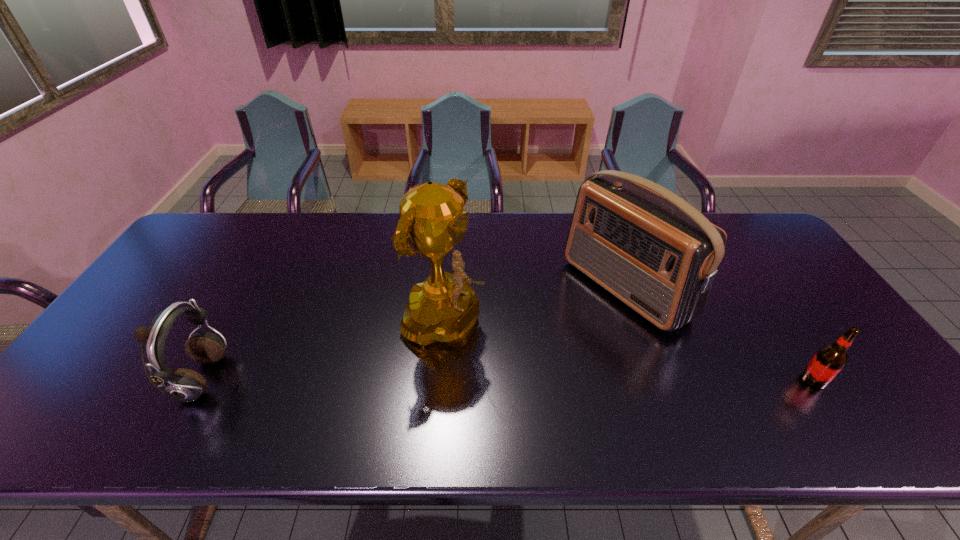
In order to click on vacant point located on the front-facing side of the radio receiver in this screenshot , I will do `click(570, 327)`.

The image size is (960, 540). Identify the location of free spot located 0.390m on the front-facing side of the radio receiver. (469, 389).

Identify the location of free space located on the front-facing side of the radio receiver. Image resolution: width=960 pixels, height=540 pixels. (560, 334).

This screenshot has width=960, height=540. What are the coordinates of `blank space located on the front side of the award` in the screenshot? It's located at (590, 402).

Identify the location of vacant region located on the front side of the award. This screenshot has height=540, width=960. (590, 402).

Locate an element on the screen. The image size is (960, 540). free region located on the front side of the award is located at coordinates (566, 390).

Where is `object present at the far edge`? The height and width of the screenshot is (540, 960). object present at the far edge is located at coordinates (651, 249).

You are a GUI agent. You are given a task and a screenshot of the screen. Output one action in this format:
    pyautogui.click(x=<x>, y=<y>)
    Task: Click on the earphone located in the near edge section of the desktop
    The height and width of the screenshot is (540, 960).
    Given the screenshot: What is the action you would take?
    pyautogui.click(x=184, y=385)

Image resolution: width=960 pixels, height=540 pixels. I want to click on root beer situated at the near edge, so click(830, 359).

Identify the location of object at the right edge. The width and height of the screenshot is (960, 540). (830, 359).